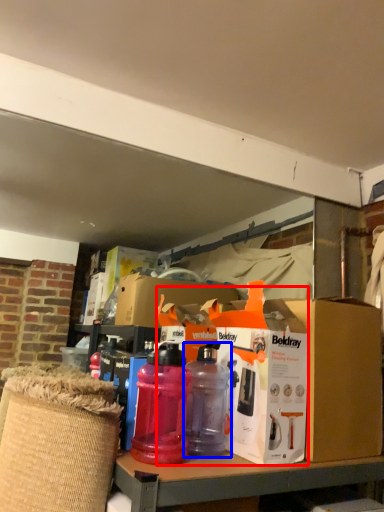
Question: Which point is further to the camera, box (highlighted by a red box) or bottle (highlighted by a blue box)?

Choices:
 (A) box
 (B) bottle

Answer: (B)